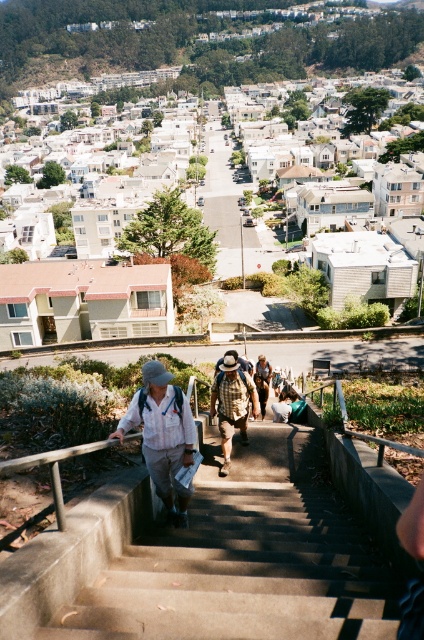
Question: Which object is farther from the camera taking this photo?

Choices:
 (A) concrete stairs at center
 (B) white cotton shirt at center

Answer: (B)

Question: Does concrete stairs at center lie behind white cotton shirt at center?

Choices:
 (A) no
 (B) yes

Answer: (A)

Question: Where is concrete stairs at center located in relation to camouflage-patterned backpack at center in the image?

Choices:
 (A) below
 (B) above

Answer: (A)

Question: Which is farther from the camouflage-patterned backpack at center?

Choices:
 (A) concrete stairs at center
 (B) white cotton shirt at center

Answer: (A)

Question: Does concrete stairs at center appear under white cotton shirt at center?

Choices:
 (A) no
 (B) yes

Answer: (B)

Question: Among these points, which one is nearest to the camera?

Choices:
 (A) (106, 592)
 (B) (136, 419)

Answer: (A)